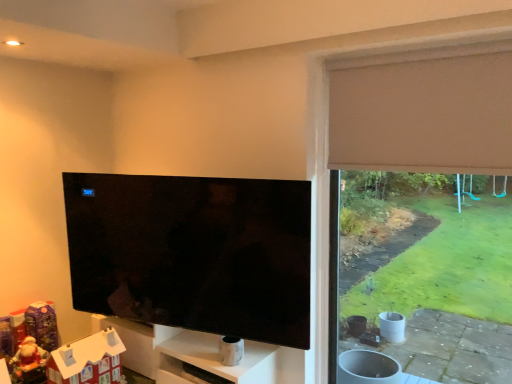
Question: Considering the relative sizes of matte black tv at center and white cardboard house at lower left in the image provided, is matte black tv at center wider than white cardboard house at lower left?

Choices:
 (A) no
 (B) yes

Answer: (A)

Question: Is matte black tv at center far away from white cardboard house at lower left?

Choices:
 (A) yes
 (B) no

Answer: (B)

Question: Is the depth of matte black tv at center less than that of white cardboard house at lower left?

Choices:
 (A) no
 (B) yes

Answer: (B)

Question: Is matte black tv at center not within white cardboard house at lower left?

Choices:
 (A) no
 (B) yes

Answer: (B)

Question: Considering the relative positions of matte black tv at center and white cardboard house at lower left in the image provided, is matte black tv at center to the left of white cardboard house at lower left from the viewer's perspective?

Choices:
 (A) no
 (B) yes

Answer: (A)

Question: Is beige fabric window frame at right taller or shorter than beige fabric curtain at upper right?

Choices:
 (A) tall
 (B) short

Answer: (A)

Question: Is point (332, 140) positioned closer to the camera than point (356, 72)?

Choices:
 (A) farther
 (B) closer

Answer: (A)

Question: Based on their positions, is beige fabric window frame at right located to the left or right of beige fabric curtain at upper right?

Choices:
 (A) right
 (B) left

Answer: (A)

Question: From a real-world perspective, relative to beige fabric curtain at upper right, is beige fabric window frame at right vertically above or below?

Choices:
 (A) below
 (B) above

Answer: (A)

Question: Considering the relative positions of beige fabric curtain at upper right and matte black tv at center in the image provided, is beige fabric curtain at upper right to the left or to the right of matte black tv at center?

Choices:
 (A) left
 (B) right

Answer: (B)

Question: Is beige fabric curtain at upper right wider or thinner than matte black tv at center?

Choices:
 (A) wide
 (B) thin

Answer: (B)

Question: From a real-world perspective, is beige fabric curtain at upper right positioned above or below matte black tv at center?

Choices:
 (A) below
 (B) above

Answer: (B)

Question: From their relative heights in the image, would you say beige fabric curtain at upper right is taller or shorter than matte black tv at center?

Choices:
 (A) short
 (B) tall

Answer: (A)

Question: Is beige fabric curtain at upper right in front of or behind white cardboard house at lower left in the image?

Choices:
 (A) front
 (B) behind

Answer: (A)

Question: From the image's perspective, relative to white cardboard house at lower left, is beige fabric curtain at upper right above or below?

Choices:
 (A) above
 (B) below

Answer: (A)